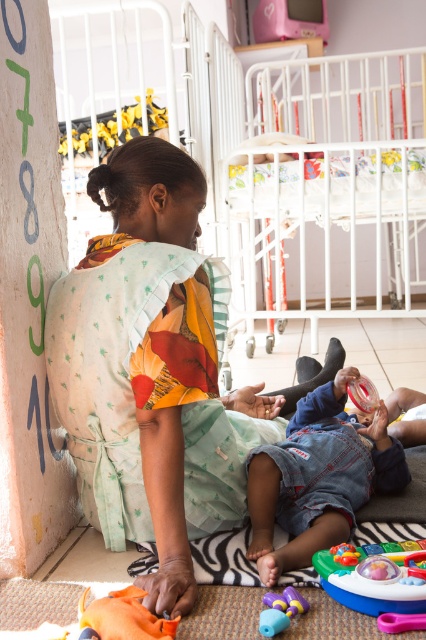
Between denim jeans at lower center and translucent purple toy at lower center, which one is positioned lower?

Positioned lower is translucent purple toy at lower center.

Who is taller, denim jeans at lower center or translucent purple toy at lower center?

Standing taller between the two is denim jeans at lower center.

Is point (373, 486) farther from viewer compared to point (293, 604)?

Yes, it is behind point (293, 604).

I want to click on denim jeans at lower center, so click(x=319, y=477).

Can you confirm if white metal crib at upper center is smaller than denim jeans at lower center?

Incorrect, white metal crib at upper center is not smaller in size than denim jeans at lower center.

Is white metal crib at upper center bigger than denim jeans at lower center?

Yes.

Measure the distance between point (347,268) and camera.

They are 16.83 feet apart.

Where is `white metal crib at upper center`? white metal crib at upper center is located at coordinates (330, 189).

Between printed fabric dress at center and translucent purple toy at lower center, which one appears on the right side from the viewer's perspective?

From the viewer's perspective, translucent purple toy at lower center appears more on the right side.

Between point (144, 355) and point (259, 618), which one is positioned in front?

Point (259, 618) is more forward.

Is point (155, 401) farther from viewer compared to point (271, 605)?

Yes, it is.

The width and height of the screenshot is (426, 640). Find the location of `printed fabric dress at center`. printed fabric dress at center is located at coordinates (152, 371).